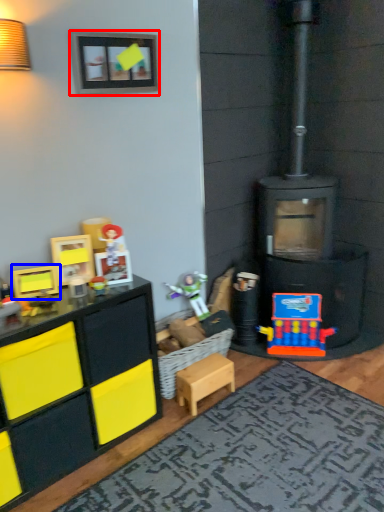
Question: Which object is closer to the camera taking this photo, picture frame (highlighted by a red box) or toy (highlighted by a blue box)?

Choices:
 (A) picture frame
 (B) toy

Answer: (B)